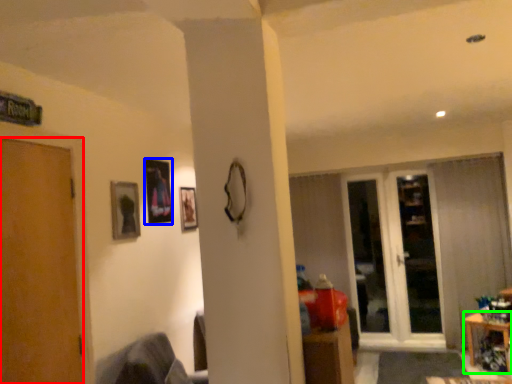
Question: Which object is positioned closest to door (highlighted by a red box)? Select from picture frame (highlighted by a blue box) and table (highlighted by a green box).

Choices:
 (A) picture frame
 (B) table

Answer: (A)